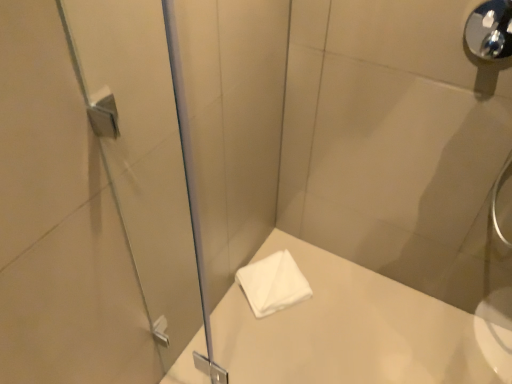
Question: Is white soft towel at center to the left of transparent glass screen door at left from the viewer's perspective?

Choices:
 (A) yes
 (B) no

Answer: (B)

Question: Does white soft towel at center have a greater width compared to transparent glass screen door at left?

Choices:
 (A) no
 (B) yes

Answer: (B)

Question: Considering the relative positions of white soft towel at center and transparent glass screen door at left in the image provided, is white soft towel at center behind transparent glass screen door at left?

Choices:
 (A) yes
 (B) no

Answer: (A)

Question: From the image's perspective, is white soft towel at center under transparent glass screen door at left?

Choices:
 (A) no
 (B) yes

Answer: (B)

Question: Considering the relative sizes of white soft towel at center and transparent glass screen door at left in the image provided, is white soft towel at center taller than transparent glass screen door at left?

Choices:
 (A) no
 (B) yes

Answer: (A)

Question: Considering the positions of point (265, 258) and point (128, 170), is point (265, 258) closer or farther from the camera than point (128, 170)?

Choices:
 (A) farther
 (B) closer

Answer: (A)

Question: Is white soft towel at center in front of or behind transparent glass screen door at left in the image?

Choices:
 (A) behind
 (B) front

Answer: (A)

Question: From a real-world perspective, is white soft towel at center positioned above or below transparent glass screen door at left?

Choices:
 (A) below
 (B) above

Answer: (A)

Question: In the image, is white soft towel at center on the left side or the right side of transparent glass screen door at left?

Choices:
 (A) left
 (B) right

Answer: (B)

Question: Does point (503, 36) appear closer or farther from the camera than point (166, 329)?

Choices:
 (A) closer
 (B) farther

Answer: (A)

Question: Considering the relative positions of polished chrome shower handle at upper right and transparent glass screen door at left in the image provided, is polished chrome shower handle at upper right to the left or to the right of transparent glass screen door at left?

Choices:
 (A) right
 (B) left

Answer: (A)

Question: From a real-world perspective, relative to transparent glass screen door at left, is polished chrome shower handle at upper right vertically above or below?

Choices:
 (A) below
 (B) above

Answer: (B)

Question: From the image's perspective, is polished chrome shower handle at upper right located above or below transparent glass screen door at left?

Choices:
 (A) above
 (B) below

Answer: (A)

Question: Considering the relative positions of transparent glass screen door at left and polished chrome shower handle at upper right in the image provided, is transparent glass screen door at left to the left or to the right of polished chrome shower handle at upper right?

Choices:
 (A) left
 (B) right

Answer: (A)

Question: Considering the positions of point (141, 34) and point (467, 28), is point (141, 34) closer or farther from the camera than point (467, 28)?

Choices:
 (A) closer
 (B) farther

Answer: (A)